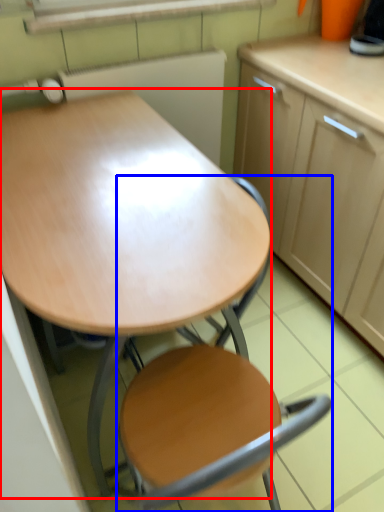
Question: Which point is closer to the camera, desk (highlighted by a red box) or chair (highlighted by a blue box)?

Choices:
 (A) desk
 (B) chair

Answer: (B)